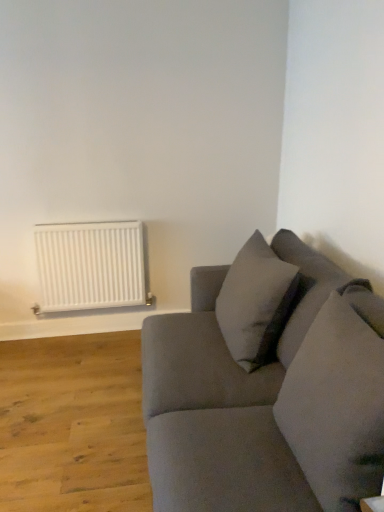
Question: In the image, is suede gray couch at right on the left side or the right side of soft gray pillow at upper right, the first pillow from the back?

Choices:
 (A) left
 (B) right

Answer: (B)

Question: From the image's perspective, relative to soft gray pillow at upper right, the first pillow from the back, is suede gray couch at right above or below?

Choices:
 (A) below
 (B) above

Answer: (A)

Question: Considering the real-world distances, which object is closest to the soft gray pillow at upper right, the first pillow from the back?

Choices:
 (A) suede gray couch at right
 (B) white matte radiator at left
 (C) suede-like gray pillow at right, which is the 1th pillow in front-to-back order

Answer: (A)

Question: Which of these objects is positioned closest to the white matte radiator at left?

Choices:
 (A) suede-like gray pillow at right, which is the 2th pillow from back to front
 (B) soft gray pillow at upper right, the first pillow from the back
 (C) suede gray couch at right

Answer: (B)